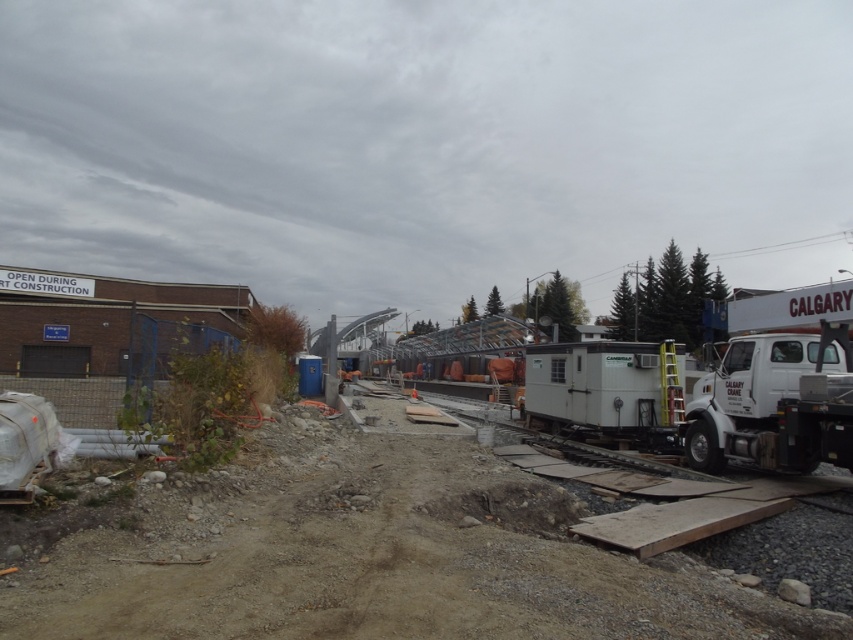
Does white metal trailer at center have a larger size compared to white matte trailer truck at right?

Correct, white metal trailer at center is larger in size than white matte trailer truck at right.

Where is `white metal trailer at center`? white metal trailer at center is located at coordinates (357, 552).

Which is more to the left, white matte trailer truck at right or white matte trailer truck at center?

From the viewer's perspective, white matte trailer truck at center appears more on the left side.

Does white matte trailer truck at right lie behind white matte trailer truck at center?

No, it is in front of white matte trailer truck at center.

In order to click on white matte trailer truck at right in this screenshot , I will do coord(764,406).

The image size is (853, 640). I want to click on white metal trailer at center, so click(357, 552).

The width and height of the screenshot is (853, 640). Describe the element at coordinates (357, 552) in the screenshot. I see `white metal trailer at center` at that location.

Locate an element on the screen. Image resolution: width=853 pixels, height=640 pixels. white metal trailer at center is located at coordinates (357, 552).